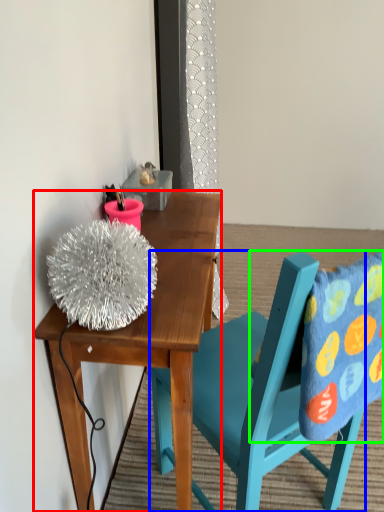
Question: Considering the real-world distances, which object is farthest from desk (highlighted by a red box)? chair (highlighted by a blue box) or pillow (highlighted by a green box)?

Choices:
 (A) chair
 (B) pillow

Answer: (B)